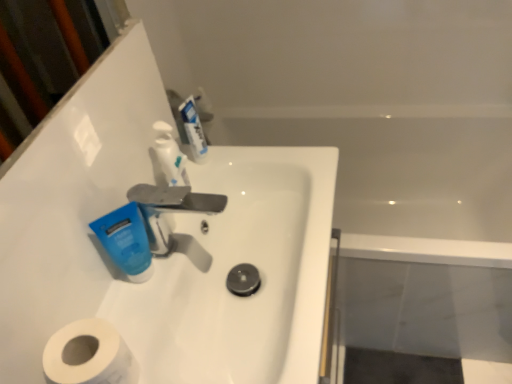
Question: In terms of size, does blue matte tube at center-left, placed as the first mouthwash when sorted from front to back, appear bigger or smaller than white glossy soap dispenser at upper center?

Choices:
 (A) big
 (B) small

Answer: (A)

Question: From the image's perspective, relative to white glossy soap dispenser at upper center, is blue matte tube at center-left, arranged as the 2th mouthwash when viewed from the top, above or below?

Choices:
 (A) below
 (B) above

Answer: (A)

Question: Considering the real-world distances, which object is farthest from the white glossy mouthwash at upper center, marked as the first mouthwash in a top-to-bottom arrangement?

Choices:
 (A) white glossy sink at center
 (B) white matte toilet paper at lower left
 (C) white glossy bathtub at upper right
 (D) silver metallic faucet at center
 (E) white glossy soap dispenser at upper center

Answer: (C)

Question: Considering the real-world distances, which object is farthest from the white glossy mouthwash at upper center, which is counted as the second mouthwash, starting from the left?

Choices:
 (A) blue matte tube at center-left, the first mouthwash positioned from the bottom
 (B) white glossy bathtub at upper right
 (C) white glossy sink at center
 (D) white matte toilet paper at lower left
 (E) white glossy soap dispenser at upper center

Answer: (B)